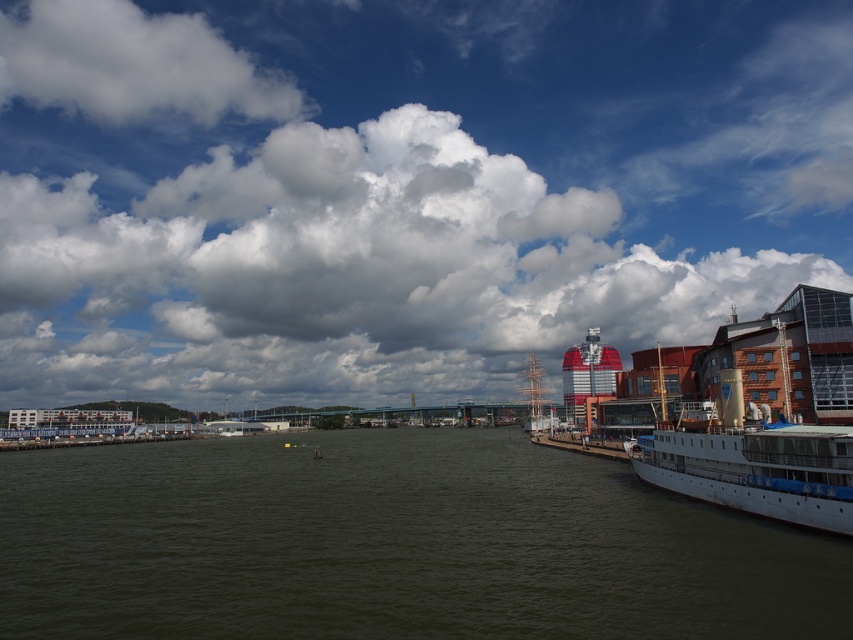
You are an airplane pilot observing the sky in the waterfront scene. You notice two clouds, the white fluffy cloud at upper center and the white fluffy cloud at upper left. Which cloud is positioned more to the right side of the sky?

The white fluffy cloud at upper center is positioned more to the right side of the sky compared to the white fluffy cloud at upper left.

You are a photographer standing on the dock and want to capture both the white fluffy cloud at upper center and the white matte ship at lower right in a single shot. Which object will appear larger in the photo?

The white fluffy cloud at upper center will appear larger in the photo because it is taller than the white matte ship at lower right.

You are an architect designing a new skyscraper that needs to comply with local height restrictions. You observe the white fluffy cloud at upper left and the white matte ship at lower right in the image. Which object is taller and must be considered in your design calculations?

The white fluffy cloud at upper left has a greater height compared to the white matte ship at lower right, so it must be considered in the design calculations.